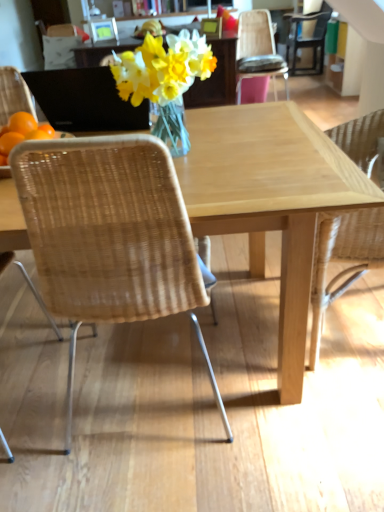
Question: From a real-world perspective, is natural wicker chair at right, arranged as the 2th chair when viewed from the front, under translucent glass vase at center?

Choices:
 (A) yes
 (B) no

Answer: (A)

Question: Is natural wicker chair at right, positioned as the third chair in top-to-bottom order, to the left of translucent glass vase at center from the viewer's perspective?

Choices:
 (A) yes
 (B) no

Answer: (B)

Question: Could you tell me if natural wicker chair at right, the second chair positioned from the bottom, is facing translucent glass vase at center?

Choices:
 (A) yes
 (B) no

Answer: (B)

Question: Is natural wicker chair at right, placed as the third chair when sorted from back to front, positioned far away from translucent glass vase at center?

Choices:
 (A) no
 (B) yes

Answer: (A)

Question: Does natural wicker chair at right, arranged as the 2th chair when viewed from the front, come behind translucent glass vase at center?

Choices:
 (A) no
 (B) yes

Answer: (A)

Question: From the image's perspective, is translucent glass vase at center above or below natural wicker chair at right, acting as the second chair starting from the left?

Choices:
 (A) below
 (B) above

Answer: (B)

Question: Would you say translucent glass vase at center is to the left or to the right of natural wicker chair at right, arranged as the 2th chair when viewed from the front, in the picture?

Choices:
 (A) left
 (B) right

Answer: (A)

Question: Based on their sizes in the image, would you say translucent glass vase at center is bigger or smaller than natural wicker chair at right, the third chair positioned from the right?

Choices:
 (A) big
 (B) small

Answer: (A)

Question: Does point (135, 96) appear closer or farther from the camera than point (372, 128)?

Choices:
 (A) closer
 (B) farther

Answer: (A)

Question: Is natural wood table at center bigger or smaller than translucent glass vase at center?

Choices:
 (A) big
 (B) small

Answer: (A)

Question: In terms of width, does natural wood table at center look wider or thinner when compared to translucent glass vase at center?

Choices:
 (A) thin
 (B) wide

Answer: (B)

Question: Based on their positions, is natural wood table at center located to the left or right of translucent glass vase at center?

Choices:
 (A) left
 (B) right

Answer: (B)

Question: From the image's perspective, is natural wood table at center positioned above or below translucent glass vase at center?

Choices:
 (A) below
 (B) above

Answer: (A)

Question: Looking at the image, does black matte laptop at upper left seem bigger or smaller compared to matte black chair at upper right, which is counted as the 4th chair, starting from the front?

Choices:
 (A) big
 (B) small

Answer: (B)

Question: From a real-world perspective, is black matte laptop at upper left positioned above or below matte black chair at upper right, which is counted as the 4th chair, starting from the front?

Choices:
 (A) below
 (B) above

Answer: (B)